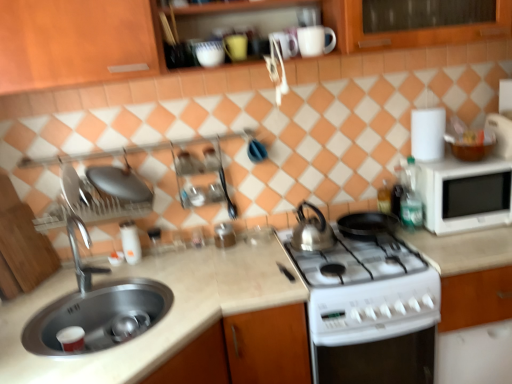
Question: Is white glossy stove at lower center in front of or behind glossy ceramic mug at upper center, the 1th mug in the left-to-right sequence, in the image?

Choices:
 (A) behind
 (B) front

Answer: (B)

Question: In terms of height, does white glossy stove at lower center look taller or shorter compared to glossy ceramic mug at upper center, which appears as the 2th mug when viewed from the right?

Choices:
 (A) short
 (B) tall

Answer: (B)

Question: Considering the real-world distances, which object is closest to the white matte countertop at center?

Choices:
 (A) metallic silver canister at center, which appears as the 1th appliance when viewed from the right
 (B) beige marble countertop at center
 (C) white glossy stove at lower center
 (D) silver metallic tap at sink left
 (E) wooden cabinet at upper center

Answer: (C)

Question: Which object is positioned closest to the satin silver kettle at center?

Choices:
 (A) white matte countertop at center
 (B) white glossy salt shaker at center, which is the first appliance from left to right
 (C) white glossy stove at lower center
 (D) glossy ceramic mug at upper center, the 1th mug in the left-to-right sequence
 (E) wooden cabinet at upper center

Answer: (C)